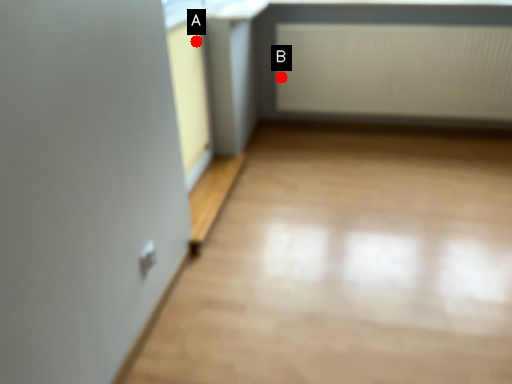
Question: Two points are circled on the image, labeled by A and B beside each circle. Which point is closer to the camera?

Choices:
 (A) A is closer
 (B) B is closer

Answer: (A)